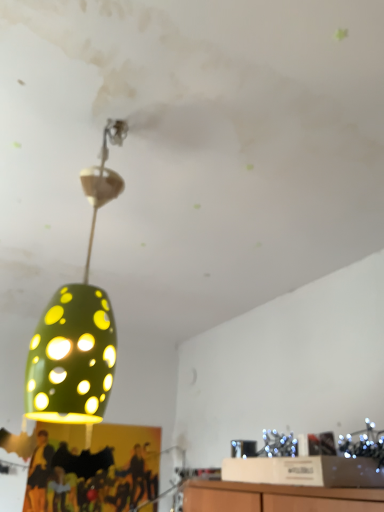
The height and width of the screenshot is (512, 384). I want to click on green matte lampshade at center, so pyautogui.click(x=221, y=70).

Measure the distance between yellow fabric person at lower left and camera.

The depth of yellow fabric person at lower left is 6.50 feet.

This screenshot has height=512, width=384. What do you see at coordinates (77, 327) in the screenshot? I see `green matte/porcelain lampshade at upper left` at bounding box center [77, 327].

Where is `green matte lampshade at center`? The image size is (384, 512). green matte lampshade at center is located at coordinates (221, 70).

Is green matte/porcelain lampshade at upper left spatially inside yellow fabric person at lower left, or outside of it?

green matte/porcelain lampshade at upper left cannot be found inside yellow fabric person at lower left.

From the picture: Which is less distant, (64, 395) or (39, 466)?

Positioned in front is point (64, 395).

From the image's perspective, does green matte/porcelain lampshade at upper left appear lower than yellow fabric person at lower left?

No, from the image's perspective, green matte/porcelain lampshade at upper left is not beneath yellow fabric person at lower left.

Is green matte/porcelain lampshade at upper left positioned far away from yellow fabric person at lower left?

That's right, there is a large distance between green matte/porcelain lampshade at upper left and yellow fabric person at lower left.

Would you say green matte lampshade at center is part of yellow fabric person at lower left's contents?

That's incorrect, green matte lampshade at center is not inside yellow fabric person at lower left.

Which is in front, point (111, 478) or point (154, 23)?

Point (154, 23)

Is yellow fabric person at lower left beside green matte lampshade at center?

No, yellow fabric person at lower left is not with green matte lampshade at center.

From the image's perspective, is yellow fabric person at lower left positioned above or below green matte lampshade at center?

yellow fabric person at lower left is below green matte lampshade at center.

Is green matte lampshade at center smaller than green matte/porcelain lampshade at upper left?

Actually, green matte lampshade at center might be larger than green matte/porcelain lampshade at upper left.

From the image's perspective, is green matte lampshade at center over green matte/porcelain lampshade at upper left?

Yes.

Between green matte lampshade at center and green matte/porcelain lampshade at upper left, which one is positioned behind?

Positioned behind is green matte/porcelain lampshade at upper left.

Is green matte lampshade at center surrounding green matte/porcelain lampshade at upper left?

No, green matte/porcelain lampshade at upper left is not inside green matte lampshade at center.

How many degrees apart are the facing directions of yellow fabric person at lower left and green matte/porcelain lampshade at upper left?

There is a 88.7-degree angle between the facing directions of yellow fabric person at lower left and green matte/porcelain lampshade at upper left.

The height and width of the screenshot is (512, 384). Identify the location of lamp above the yellow fabric person at lower left (from the image's perspective). (77, 327).

From the image's perspective, relative to green matte/porcelain lampshade at upper left, is yellow fabric person at lower left above or below?

Clearly, from the image's perspective, yellow fabric person at lower left is below green matte/porcelain lampshade at upper left.

Is yellow fabric person at lower left taller than green matte/porcelain lampshade at upper left?

No, yellow fabric person at lower left is not taller than green matte/porcelain lampshade at upper left.

Is green matte/porcelain lampshade at upper left positioned with its back to green matte lampshade at center?

That's not correct — green matte/porcelain lampshade at upper left is not looking away from green matte lampshade at center.

Considering the positions of points (35, 400) and (189, 16), is point (35, 400) farther from camera compared to point (189, 16)?

That is False.

How much distance is there between green matte/porcelain lampshade at upper left and green matte lampshade at center?

The distance of green matte/porcelain lampshade at upper left from green matte lampshade at center is 22.93 inches.

From a real-world perspective, which object rests below the other?

green matte/porcelain lampshade at upper left is physically lower.

In the scene shown: From a real-world perspective, is green matte lampshade at center physically located above or below yellow fabric person at lower left?

green matte lampshade at center is above yellow fabric person at lower left.

Which is more to the right, green matte lampshade at center or yellow fabric person at lower left?

green matte lampshade at center.

Considering the sizes of green matte lampshade at center and yellow fabric person at lower left in the image, is green matte lampshade at center taller or shorter than yellow fabric person at lower left?

Considering their sizes, green matte lampshade at center has less height than yellow fabric person at lower left.

How different are the orientations of green matte lampshade at center and yellow fabric person at lower left in degrees?

The facing directions of green matte lampshade at center and yellow fabric person at lower left are 90.7 degrees apart.

The width and height of the screenshot is (384, 512). What are the coordinates of `lamp above the yellow fabric person at lower left (from the image's perspective)` in the screenshot? It's located at (77, 327).

This screenshot has height=512, width=384. Identify the location of cloud located on the right of yellow fabric person at lower left. (221, 70).

When comparing their distances from yellow fabric person at lower left, does green matte lampshade at center or green matte/porcelain lampshade at upper left seem further?

Based on the image, green matte lampshade at center appears to be further to yellow fabric person at lower left.

Looking at the image, which one is located further to yellow fabric person at lower left, green matte/porcelain lampshade at upper left or green matte lampshade at center?

Among the two, green matte lampshade at center is located further to yellow fabric person at lower left.

Which object lies nearer to the anchor point green matte lampshade at center, green matte/porcelain lampshade at upper left or yellow fabric person at lower left?

green matte/porcelain lampshade at upper left lies closer to green matte lampshade at center than the other object.

Estimate the real-world distances between objects in this image. Which object is closer to green matte/porcelain lampshade at upper left, green matte lampshade at center or yellow fabric person at lower left?

Based on the image, green matte lampshade at center appears to be nearer to green matte/porcelain lampshade at upper left.

Which object lies further to the anchor point green matte lampshade at center, yellow fabric person at lower left or green matte/porcelain lampshade at upper left?

yellow fabric person at lower left is further to green matte lampshade at center.

Based on their spatial positions, is yellow fabric person at lower left or green matte lampshade at center further from green matte/porcelain lampshade at upper left?

yellow fabric person at lower left.

The height and width of the screenshot is (512, 384). I want to click on lamp positioned between green matte lampshade at center and yellow fabric person at lower left from near to far, so click(x=77, y=327).